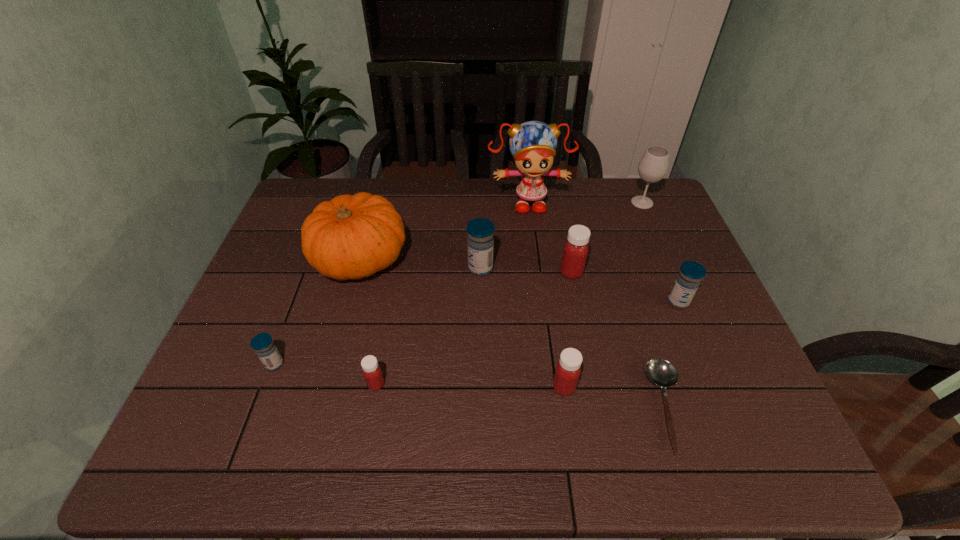
You are a GUI agent. You are given a task and a screenshot of the screen. Output one action in this format:
    pyautogui.click(x=<x>, y=<y>)
    Task: Click on the third medicine from right to left
    The image size is (960, 540).
    Given the screenshot: What is the action you would take?
    pyautogui.click(x=568, y=369)

At what (x,y) coordinates should I click in order to perform the action: click on the leftmost blue medicine. Please return your answer as a coordinate pair (x, y). Looking at the image, I should click on (263, 345).

This screenshot has height=540, width=960. What are the coordinates of `the nearest blue medicine` in the screenshot? It's located at (263, 345).

Image resolution: width=960 pixels, height=540 pixels. I want to click on the leftmost red medicine, so click(x=372, y=373).

The height and width of the screenshot is (540, 960). What are the coordinates of `the second medicine from left to right` in the screenshot? It's located at (372, 373).

Find the location of a particular element. This screenshot has width=960, height=540. ladle is located at coordinates (661, 372).

This screenshot has height=540, width=960. I want to click on the eighth object from left to right, so click(661, 372).

Where is `vacant space located 0.110m on the face of the tallest object`? vacant space located 0.110m on the face of the tallest object is located at coordinates (533, 240).

I want to click on vacant space situated on the front of the wineglass, so click(x=662, y=251).

This screenshot has height=540, width=960. In order to click on free region located 0.070m on the front of the pumpkin in this screenshot , I will do `click(346, 315)`.